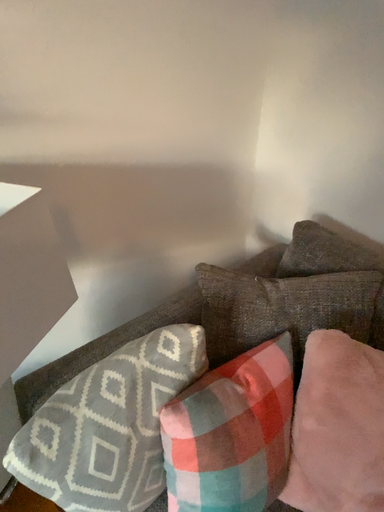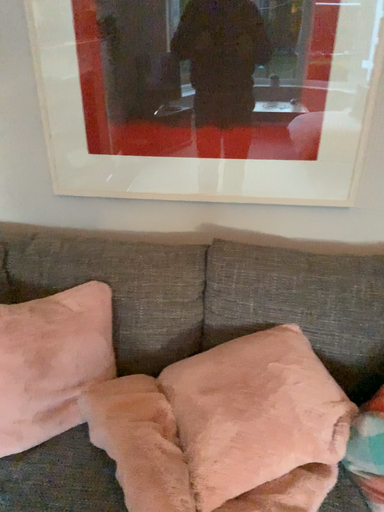
Question: Which way did the camera rotate in the video?

Choices:
 (A) rotated left
 (B) rotated right

Answer: (B)